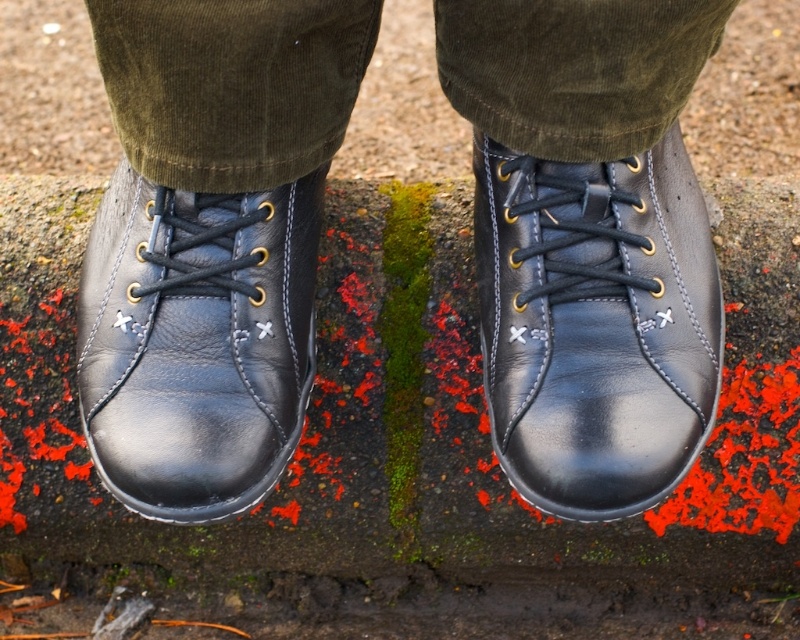
Is point (688, 244) positioned behind point (556, 170)?

Yes, it is.

Is black leather shoes at center taller than shiny black leather boot at center?

Yes.

Between point (516, 44) and point (570, 307), which one is positioned behind?

The point (570, 307) is more distant.

At what (x,y) coordinates should I click in order to perform the action: click on black leather shoes at center. Please return your answer as a coordinate pair (x, y). This screenshot has height=640, width=800. Looking at the image, I should click on (588, 241).

This screenshot has width=800, height=640. What do you see at coordinates (596, 324) in the screenshot? I see `shiny black leather boot at center` at bounding box center [596, 324].

This screenshot has width=800, height=640. What are the coordinates of `shiny black leather boot at center` in the screenshot? It's located at (596, 324).

Which is behind, point (584, 225) or point (248, 403)?

Point (584, 225)

Identify the location of shiny black leather boot at center. Image resolution: width=800 pixels, height=640 pixels. (596, 324).

Who is more distant from viewer, (564, 212) or (106, 458)?

Point (564, 212)

Which is behind, point (312, 156) or point (248, 284)?

Positioned behind is point (248, 284).

Identify the location of black leather shoes at center. The height and width of the screenshot is (640, 800). (588, 241).